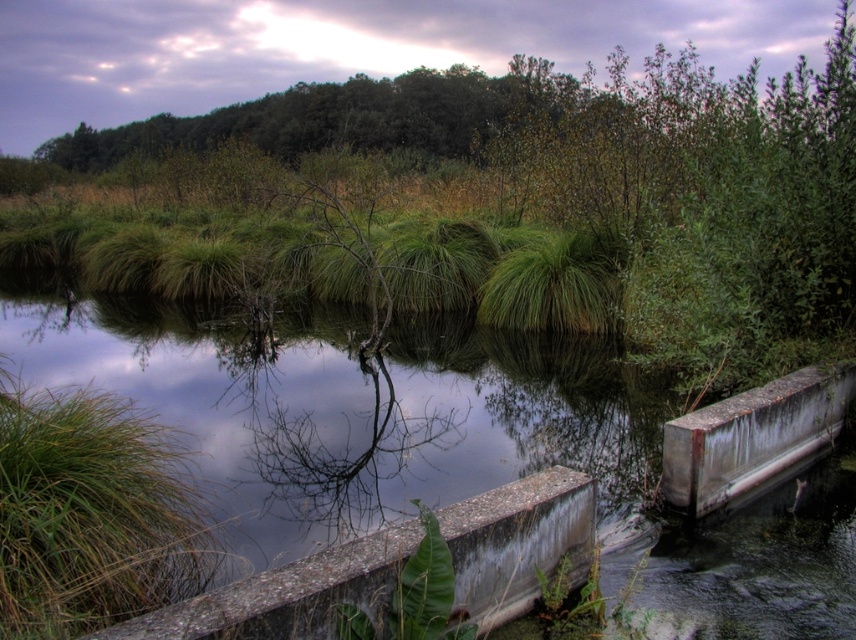
Question: Can you confirm if green grass at center is smaller than concrete ledge at lower center?

Choices:
 (A) yes
 (B) no

Answer: (B)

Question: Which point is closer to the camera taking this photo?

Choices:
 (A) (294, 582)
 (B) (250, 227)

Answer: (A)

Question: Does green grass at center have a greater width compared to concrete ledge at lower center?

Choices:
 (A) no
 (B) yes

Answer: (B)

Question: Can you confirm if green grass at center is bigger than concrete ledge at lower center?

Choices:
 (A) no
 (B) yes

Answer: (B)